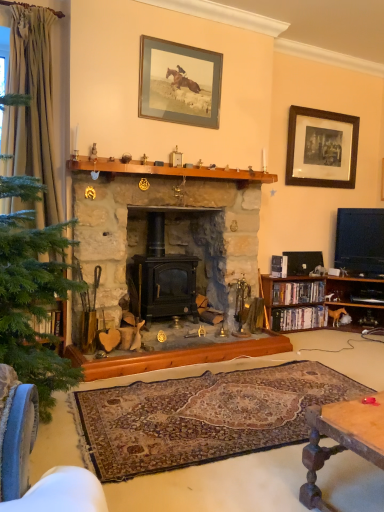
Question: Are black plastic dvds at right, the first book in the bottom-to-top sequence, and wooden mantle at center making contact?

Choices:
 (A) no
 (B) yes

Answer: (A)

Question: Is black plastic dvds at right, the first book in the bottom-to-top sequence, outside of wooden mantle at center?

Choices:
 (A) yes
 (B) no

Answer: (A)

Question: From the image's perspective, would you say black plastic dvds at right, the second book from the top, is positioned over wooden mantle at center?

Choices:
 (A) yes
 (B) no

Answer: (B)

Question: Does black plastic dvds at right, the first book in the bottom-to-top sequence, have a larger size compared to wooden mantle at center?

Choices:
 (A) no
 (B) yes

Answer: (A)

Question: Is black plastic dvds at right, the first book in the bottom-to-top sequence, far away from wooden mantle at center?

Choices:
 (A) yes
 (B) no

Answer: (A)

Question: Can you confirm if black plastic dvds at right, the first book in the bottom-to-top sequence, is wider than wooden mantle at center?

Choices:
 (A) no
 (B) yes

Answer: (A)

Question: Is black wood picture frame at upper right, which ranks as the first picture frame in right-to-left order, wider than hardcover books at right, the 1th book in the top-to-bottom sequence?

Choices:
 (A) no
 (B) yes

Answer: (A)

Question: Can you confirm if black wood picture frame at upper right, marked as the second picture frame in a left-to-right arrangement, is taller than hardcover books at right, which appears as the 2th book when ordered from the bottom?

Choices:
 (A) yes
 (B) no

Answer: (A)

Question: Is black wood picture frame at upper right, which ranks as the 1th picture frame in back-to-front order, positioned before hardcover books at right, the 1th book in the top-to-bottom sequence?

Choices:
 (A) yes
 (B) no

Answer: (B)

Question: From a real-world perspective, is black wood picture frame at upper right, marked as the second picture frame in a left-to-right arrangement, positioned under hardcover books at right, the 1th book in the top-to-bottom sequence, based on gravity?

Choices:
 (A) yes
 (B) no

Answer: (B)

Question: Can you confirm if black wood picture frame at upper right, which ranks as the first picture frame in right-to-left order, is smaller than hardcover books at right, the 1th book in the top-to-bottom sequence?

Choices:
 (A) no
 (B) yes

Answer: (A)

Question: Is black wood picture frame at upper right, marked as the second picture frame in a left-to-right arrangement, bigger than hardcover books at right, which appears as the 2th book when ordered from the bottom?

Choices:
 (A) yes
 (B) no

Answer: (A)

Question: Considering the relative sizes of wooden bookshelf at right and black stone fireplace at center in the image provided, is wooden bookshelf at right thinner than black stone fireplace at center?

Choices:
 (A) yes
 (B) no

Answer: (A)